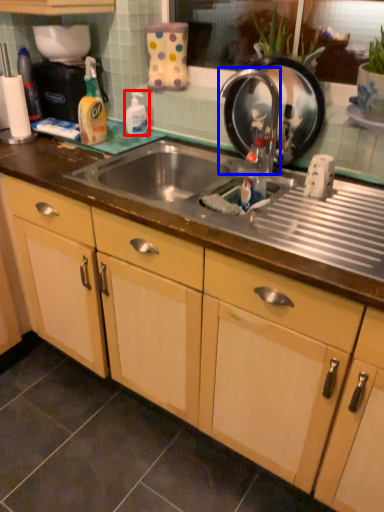
Question: Which object is closer to the camera taking this photo, cleaning product (highlighted by a red box) or faucet (highlighted by a blue box)?

Choices:
 (A) cleaning product
 (B) faucet

Answer: (B)